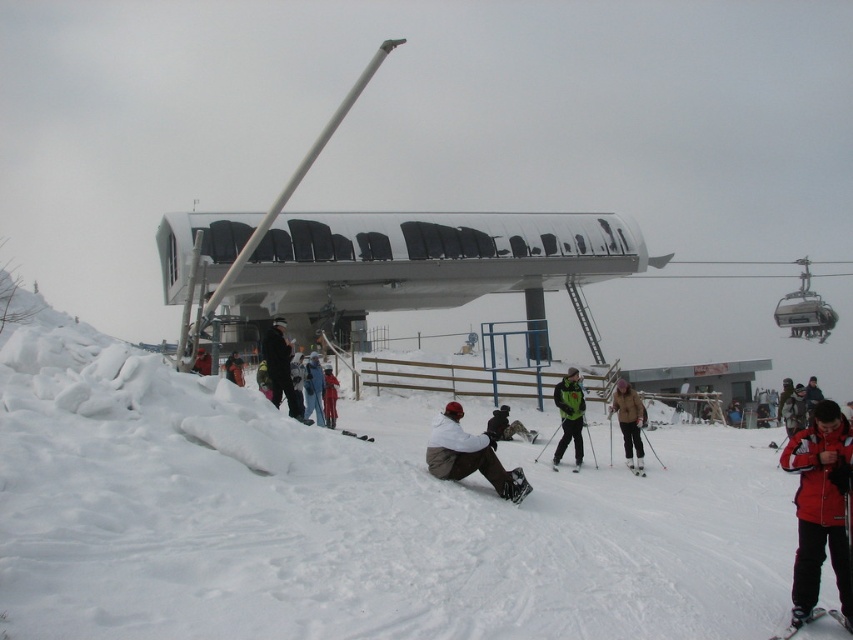
Question: Can you confirm if orange ski suit at center is smaller than black matte ski at lower center?

Choices:
 (A) no
 (B) yes

Answer: (B)

Question: Is camouflage jacket at center below white matte ski at lower center?

Choices:
 (A) no
 (B) yes

Answer: (A)

Question: From the image, what is the correct spatial relationship of black matte jacket at center in relation to black matte ski at lower center?

Choices:
 (A) left
 (B) right

Answer: (A)

Question: Which of the following is the closest to the observer?

Choices:
 (A) blue jeans at lower center
 (B) camouflage jacket at center

Answer: (A)

Question: Estimate the real-world distances between objects in this image. Which object is farther from the red matte jacket at lower right?

Choices:
 (A) orange ski suit at center
 (B) black matte ski at lower center
 (C) white powdery snow at lower left

Answer: (A)

Question: Based on their relative distances, which object is farther from the black matte ski at lower right?

Choices:
 (A) red matte jacket at lower right
 (B) black matte ski at lower center
 (C) camouflage jacket at center

Answer: (C)